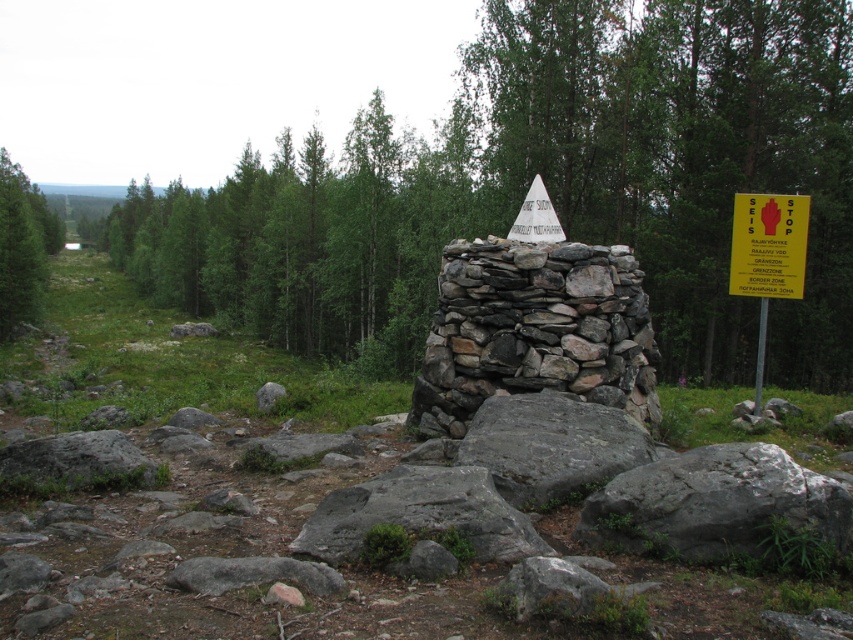
Can you confirm if natural stone cairn at center is thinner than yellow paper triangle at center?

No, natural stone cairn at center is not thinner than yellow paper triangle at center.

Describe the element at coordinates (535, 330) in the screenshot. This screenshot has height=640, width=853. I see `natural stone cairn at center` at that location.

Where is `natural stone cairn at center`? natural stone cairn at center is located at coordinates pyautogui.click(x=535, y=330).

Can you confirm if green leafy tree at left is positioned below yellow paper triangle at center?

Actually, green leafy tree at left is above yellow paper triangle at center.

Is green leafy tree at left bigger than yellow paper triangle at center?

Indeed, green leafy tree at left has a larger size compared to yellow paper triangle at center.

Does point (9, 291) lie behind point (511, 228)?

Yes, point (9, 291) is farther from viewer.

The height and width of the screenshot is (640, 853). I want to click on green leafy tree at left, so click(22, 246).

Who is higher up, green leafy tree at center or natural stone cairn at center?

green leafy tree at center

Is point (607, 99) farther from camera compared to point (573, 340)?

Yes, point (607, 99) is farther from viewer.

Between point (840, 296) and point (477, 262), which one is positioned behind?

Point (840, 296)

Locate an element on the screen. The image size is (853, 640). green leafy tree at center is located at coordinates (550, 186).